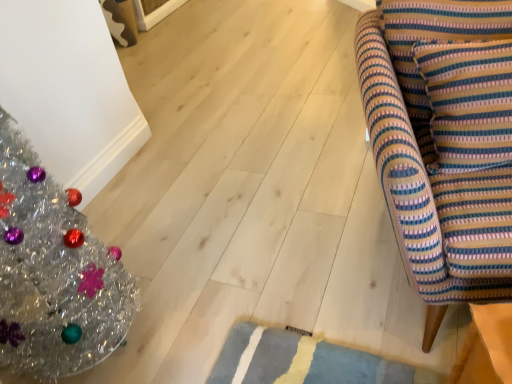
Locate an element on the screen. Image resolution: width=512 pixels, height=384 pixels. vacant space behind shiny silver christmas tree at left is located at coordinates (139, 229).